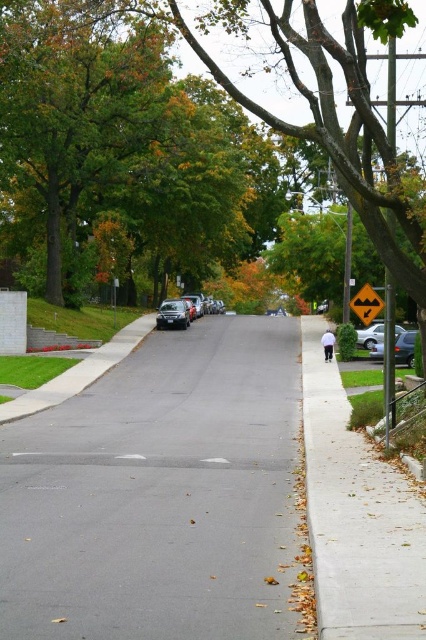
Locate an element on the screen. This screenshot has height=640, width=426. shiny silver sedan at center is located at coordinates (178, 310).

Does shiny silver sedan at center appear on the right side of silver metallic sedan at right?

In fact, shiny silver sedan at center is to the left of silver metallic sedan at right.

Describe the element at coordinates (178, 310) in the screenshot. I see `shiny silver sedan at center` at that location.

Identify the location of shiny silver sedan at center. (178, 310).

Which is below, yellow reflective plastic triangle at right or shiny black sedan at center?

Positioned lower is yellow reflective plastic triangle at right.

Is yellow reflective plastic triangle at right shorter than shiny black sedan at center?

Correct, yellow reflective plastic triangle at right is not as tall as shiny black sedan at center.

Where is `yellow reflective plastic triangle at right`? The height and width of the screenshot is (640, 426). yellow reflective plastic triangle at right is located at coordinates (367, 305).

Between green leafy tree at center and silver metallic sedan at right, which one appears on the left side from the viewer's perspective?

green leafy tree at center is more to the left.

Consider the image. Can you confirm if green leafy tree at center is thinner than silver metallic sedan at right?

Incorrect, green leafy tree at center's width is not less than silver metallic sedan at right's.

Between point (409, 227) and point (357, 340), which one is positioned behind?

Point (357, 340)

Locate an element on the screen. green leafy tree at center is located at coordinates (x=172, y=141).